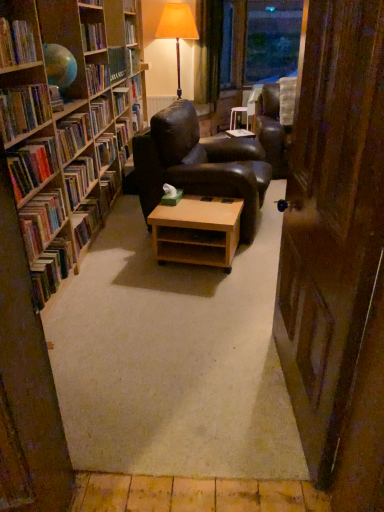
Question: Is hardcover book at left, the second book when ordered from bottom to top, outside of hardcover book at left, which is counted as the eighth book, starting from the bottom?

Choices:
 (A) yes
 (B) no

Answer: (A)

Question: Can you confirm if hardcover book at left, the eighth book viewed from the top, is shorter than hardcover book at left, which is counted as the eighth book, starting from the bottom?

Choices:
 (A) yes
 (B) no

Answer: (B)

Question: Can you confirm if hardcover book at left, the second book when ordered from bottom to top, is bigger than hardcover book at left, marked as the 2th book in a top-to-bottom arrangement?

Choices:
 (A) yes
 (B) no

Answer: (A)

Question: From the image's perspective, is hardcover book at left, the second book when ordered from bottom to top, on top of hardcover book at left, which is counted as the eighth book, starting from the bottom?

Choices:
 (A) no
 (B) yes

Answer: (A)

Question: Could you tell me if hardcover book at left, the eighth book viewed from the top, is turned towards hardcover book at left, marked as the 2th book in a top-to-bottom arrangement?

Choices:
 (A) yes
 (B) no

Answer: (B)

Question: Visually, is hardcover books at left, the 5th book in the bottom-to-top sequence, positioned to the left or to the right of green velvet curtain at upper center?

Choices:
 (A) right
 (B) left

Answer: (B)

Question: Would you say hardcover books at left, the 5th book in the bottom-to-top sequence, is inside or outside green velvet curtain at upper center?

Choices:
 (A) inside
 (B) outside

Answer: (B)

Question: Considering the positions of hardcover books at left, the fifth book viewed from the top, and green velvet curtain at upper center in the image, is hardcover books at left, the fifth book viewed from the top, bigger or smaller than green velvet curtain at upper center?

Choices:
 (A) small
 (B) big

Answer: (A)

Question: Considering the positions of hardcover books at left, the fifth book viewed from the top, and green velvet curtain at upper center in the image, is hardcover books at left, the fifth book viewed from the top, wider or thinner than green velvet curtain at upper center?

Choices:
 (A) thin
 (B) wide

Answer: (A)

Question: From the image's perspective, is hardcover book at left, the eighth book viewed from the top, above or below hardcover book at left, which is the 9th book from bottom to top?

Choices:
 (A) above
 (B) below

Answer: (B)

Question: Is hardcover book at left, the eighth book viewed from the top, in front of or behind hardcover book at left, which ranks as the first book in top-to-bottom order, in the image?

Choices:
 (A) behind
 (B) front

Answer: (B)

Question: From a real-world perspective, is hardcover book at left, the second book when ordered from bottom to top, physically located above or below hardcover book at left, which is the 9th book from bottom to top?

Choices:
 (A) above
 (B) below

Answer: (B)

Question: From their relative heights in the image, would you say hardcover book at left, the eighth book viewed from the top, is taller or shorter than hardcover book at left, which is the 9th book from bottom to top?

Choices:
 (A) tall
 (B) short

Answer: (A)

Question: From a real-world perspective, is hardcover books at left, which is counted as the 6th book, starting from the top, physically located above or below hardcover books at left, the 5th book in the bottom-to-top sequence?

Choices:
 (A) below
 (B) above

Answer: (B)

Question: Looking at their shapes, would you say hardcover books at left, marked as the 4th book in a bottom-to-top arrangement, is wider or thinner than hardcover books at left, the fifth book viewed from the top?

Choices:
 (A) wide
 (B) thin

Answer: (A)